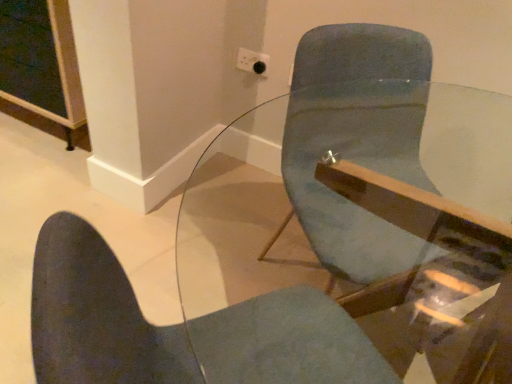
Where is `white plastic socket at upper center`? white plastic socket at upper center is located at coordinates (252, 62).

What do you see at coordinates (353, 237) in the screenshot? I see `transparent glass table at center` at bounding box center [353, 237].

What do you see at coordinates (180, 328) in the screenshot? I see `matte blue chair at center` at bounding box center [180, 328].

Measure the distance between point (272,352) and camera.

The distance of point (272,352) from camera is 31.54 inches.

In order to click on white plastic socket at upper center in this screenshot , I will do `click(252, 62)`.

Find the location of a particular element. Image resolution: width=512 pixels, height=384 pixels. table located on the right of white plastic socket at upper center is located at coordinates (353, 237).

In terms of width, does transparent glass table at center look wider or thinner when compared to white plastic socket at upper center?

Clearly, transparent glass table at center has more width compared to white plastic socket at upper center.

Could you tell me if transparent glass table at center is facing white plastic socket at upper center?

No, transparent glass table at center is not facing towards white plastic socket at upper center.

Are matte blue chair at center and white plastic socket at upper center far apart?

Yes.

Is matte blue chair at center further to camera compared to white plastic socket at upper center?

No.

Can you confirm if matte blue chair at center is thinner than white plastic socket at upper center?

No.

Looking at this image, from the image's perspective, relative to white plastic socket at upper center, is matte blue chair at center above or below?

Clearly, from the image's perspective, matte blue chair at center is below white plastic socket at upper center.

From the image's perspective, is white plastic socket at upper center below transparent glass table at center?

No.

In terms of width, does white plastic socket at upper center look wider or thinner when compared to transparent glass table at center?

In the image, white plastic socket at upper center appears to be more narrow than transparent glass table at center.

Considering the relative positions of white plastic socket at upper center and transparent glass table at center in the image provided, is white plastic socket at upper center in front of transparent glass table at center?

No, it is behind transparent glass table at center.

Considering the relative sizes of white plastic socket at upper center and transparent glass table at center in the image provided, is white plastic socket at upper center shorter than transparent glass table at center?

Correct, white plastic socket at upper center is not as tall as transparent glass table at center.

From the image's perspective, would you say transparent glass table at center is shown under matte blue chair at center?

Yes, from the image's perspective, transparent glass table at center is below matte blue chair at center.

Who is smaller, transparent glass table at center or matte blue chair at center?

matte blue chair at center is smaller.

Is transparent glass table at center inside or outside of matte blue chair at center?

transparent glass table at center exists outside the volume of matte blue chair at center.

Is transparent glass table at center further to camera compared to matte blue chair at center?

No, transparent glass table at center is in front of matte blue chair at center.

The height and width of the screenshot is (384, 512). I want to click on chair behind the transparent glass table at center, so click(180, 328).

From the image's perspective, is matte blue chair at center on transparent glass table at center?

Indeed, from the image's perspective, matte blue chair at center is shown above transparent glass table at center.

Does matte blue chair at center have a smaller size compared to transparent glass table at center?

Correct, matte blue chair at center occupies less space than transparent glass table at center.

Considering the positions of objects matte blue chair at center and transparent glass table at center in the image provided, who is in front, matte blue chair at center or transparent glass table at center?

Positioned in front is transparent glass table at center.

Is matte blue chair at center a part of white plastic socket at upper center?

Actually, matte blue chair at center is outside white plastic socket at upper center.

From the picture: Between white plastic socket at upper center and matte blue chair at center, which one is positioned in front?

matte blue chair at center is more forward.

From the image's perspective, which one is positioned higher, white plastic socket at upper center or matte blue chair at center?

From the image's view, white plastic socket at upper center is above.

Find the location of `electric outlet on the left of transparent glass table at center`. electric outlet on the left of transparent glass table at center is located at coordinates (252, 62).

Where is `electric outlet located on the right of matte blue chair at center`? electric outlet located on the right of matte blue chair at center is located at coordinates (252, 62).

Based on their spatial positions, is white plastic socket at upper center or matte blue chair at center closer to transparent glass table at center?

matte blue chair at center lies closer to transparent glass table at center than the other object.

When comparing their distances from white plastic socket at upper center, does matte blue chair at center or transparent glass table at center seem further?

Based on the image, matte blue chair at center appears to be further to white plastic socket at upper center.

Considering their positions, is transparent glass table at center positioned further to matte blue chair at center than white plastic socket at upper center?

Based on the image, white plastic socket at upper center appears to be further to matte blue chair at center.

When comparing their distances from white plastic socket at upper center, does transparent glass table at center or matte blue chair at center seem closer?

Among the two, transparent glass table at center is located nearer to white plastic socket at upper center.

Looking at the image, which one is located closer to transparent glass table at center, matte blue chair at center or white plastic socket at upper center?

matte blue chair at center is closer to transparent glass table at center.

Looking at this image, which object lies nearer to the anchor point matte blue chair at center, white plastic socket at upper center or transparent glass table at center?

transparent glass table at center.

Identify the location of chair located between transparent glass table at center and white plastic socket at upper center in the depth direction. (180, 328).